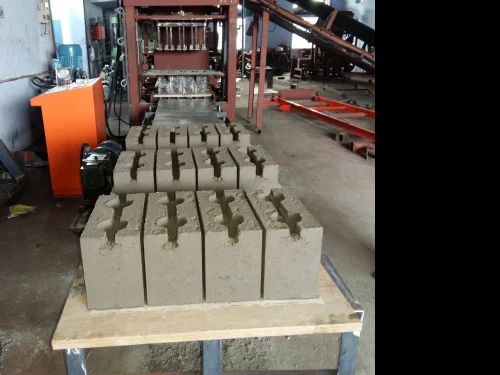
You are a GUI agent. You are given a task and a screenshot of the screen. Output one action in this format:
    pyautogui.click(x=<x>, y=<y>)
    Task: Click on the center table leg
    
    Given the screenshot: What is the action you would take?
    pyautogui.click(x=212, y=348)